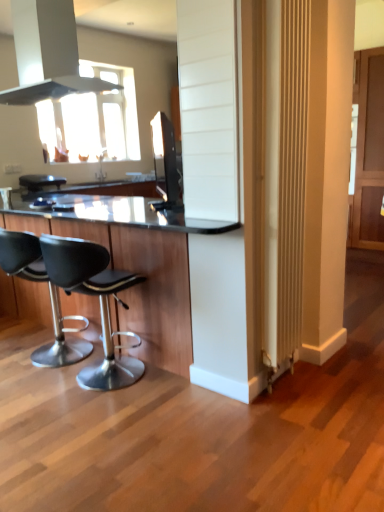
In order to face satin black tv at upper center, should I rotate leftwards or rightwards?

You should rotate left by 4.510 degrees.

Locate an element on the screen. The width and height of the screenshot is (384, 512). black matte exhaust hood at upper left is located at coordinates (47, 53).

This screenshot has height=512, width=384. What do you see at coordinates (40, 181) in the screenshot?
I see `black leather bar stool at center` at bounding box center [40, 181].

Locate an element on the screen. The width and height of the screenshot is (384, 512). black glass table at center is located at coordinates (133, 263).

The image size is (384, 512). I want to click on black leather stool at left, the second chair in the left-to-right sequence, so click(99, 300).

Locate an element on the screen. Image resolution: width=384 pixels, height=512 pixels. satin black tv at upper center is located at coordinates (165, 162).

Based on the photo, how different are the orientations of black leather stool at lower left, the 2th chair positioned from the right, and black leather bar stool at center in degrees?

They differ by 91.6 degrees in their facing directions.

Is black leather stool at lower left, the first chair positioned from the left, spatially inside black leather bar stool at center, or outside of it?

black leather stool at lower left, the first chair positioned from the left, is outside black leather bar stool at center.

From the image's perspective, is black leather stool at lower left, the first chair positioned from the left, beneath black leather bar stool at center?

Correct, black leather stool at lower left, the first chair positioned from the left, appears lower than black leather bar stool at center in the image.

Between point (55, 302) and point (40, 189), which one is positioned in front?

The point (55, 302) is more forward.

How distant is black leather bar stool at center from black matte exhaust hood at upper left?

A distance of 5.30 feet exists between black leather bar stool at center and black matte exhaust hood at upper left.

Would you say black leather bar stool at center is to the left or to the right of black matte exhaust hood at upper left in the picture?

Based on their positions, black leather bar stool at center is located to the left of black matte exhaust hood at upper left.

The image size is (384, 512). Identify the location of bar stool that appears behind the black matte exhaust hood at upper left. (40, 181).

Is black leather bar stool at center directly adjacent to black matte exhaust hood at upper left?

They are not placed beside each other.

Based on the photo, from a real-world perspective, between satin black tv at upper center and black matte exhaust hood at upper left, who is vertically higher?

black matte exhaust hood at upper left.

Considering the relative positions of satin black tv at upper center and black matte exhaust hood at upper left in the image provided, is satin black tv at upper center to the left or to the right of black matte exhaust hood at upper left?

Based on their positions, satin black tv at upper center is located to the right of black matte exhaust hood at upper left.

Is satin black tv at upper center smaller than black matte exhaust hood at upper left?

Correct, satin black tv at upper center occupies less space than black matte exhaust hood at upper left.

Can you confirm if satin black tv at upper center is taller than black matte exhaust hood at upper left?

Incorrect, the height of satin black tv at upper center is not larger of that of black matte exhaust hood at upper left.

Could you tell me if black leather bar stool at center is facing satin black tv at upper center?

Yes, black leather bar stool at center is turned towards satin black tv at upper center.

Where is `appliance to the right of black leather bar stool at center`? Image resolution: width=384 pixels, height=512 pixels. appliance to the right of black leather bar stool at center is located at coordinates (165, 162).

Who is taller, black leather bar stool at center or satin black tv at upper center?

satin black tv at upper center.

Is black leather bar stool at center facing away from black leather stool at lower left, the 2th chair positioned from the right?

No.

From the image's perspective, who appears lower, black leather bar stool at center or black leather stool at lower left, the first chair positioned from the left?

black leather stool at lower left, the first chair positioned from the left, appears lower in the image.

Is point (30, 187) closer or farther from the camera than point (42, 268)?

Clearly, point (30, 187) is more distant from the camera than point (42, 268).

Which of these two, black leather bar stool at center or black leather stool at lower left, the 2th chair positioned from the right, stands taller?

black leather stool at lower left, the 2th chair positioned from the right, is taller.

What's the angular difference between black matte exhaust hood at upper left and black leather bar stool at center's facing directions?

They differ by 92.6 degrees in their facing directions.

In terms of size, does black matte exhaust hood at upper left appear bigger or smaller than black leather bar stool at center?

Considering their sizes, black matte exhaust hood at upper left takes up more space than black leather bar stool at center.

Considering the sizes of objects black matte exhaust hood at upper left and black leather bar stool at center in the image provided, who is shorter, black matte exhaust hood at upper left or black leather bar stool at center?

Standing shorter between the two is black leather bar stool at center.

Does black glass table at center have a larger size compared to black matte exhaust hood at upper left?

Yes.

Find the location of a particular element. This screenshot has width=384, height=512. exhaust hood that is above the black glass table at center (from a real-world perspective) is located at coordinates (47, 53).

What's the angular difference between black glass table at center and black matte exhaust hood at upper left's facing directions?

The facing directions of black glass table at center and black matte exhaust hood at upper left are 0.311 degrees apart.

Between black glass table at center and black matte exhaust hood at upper left, which one is positioned behind?

black matte exhaust hood at upper left is behind.

You are a GUI agent. You are given a task and a screenshot of the screen. Output one action in this format:
    pyautogui.click(x=<x>, y=<y>)
    Task: Click on the chair that is the 1st one when counting rightward from the black leather bar stool at center
    The width and height of the screenshot is (384, 512).
    Given the screenshot: What is the action you would take?
    point(50,297)

Locate an element on the screen. The image size is (384, 512). exhaust hood lying in front of the black leather bar stool at center is located at coordinates (47, 53).

From the image, which object appears to be nearer to black leather bar stool at center, black glass table at center or black leather stool at lower left, the 2th chair positioned from the right?

Based on the image, black leather stool at lower left, the 2th chair positioned from the right, appears to be nearer to black leather bar stool at center.

Based on the photo, based on their spatial positions, is satin black tv at upper center or black glass table at center further from black matte exhaust hood at upper left?

satin black tv at upper center lies further to black matte exhaust hood at upper left than the other object.

From the picture: Considering their positions, is black glass table at center positioned closer to satin black tv at upper center than black leather stool at lower left, the 2th chair positioned from the right?

black leather stool at lower left, the 2th chair positioned from the right, is positioned closer to the anchor satin black tv at upper center.

Consider the image. Which object lies further to the anchor point black leather stool at left, positioned as the 1th chair in right-to-left order, satin black tv at upper center or black matte exhaust hood at upper left?

Based on the image, satin black tv at upper center appears to be further to black leather stool at left, positioned as the 1th chair in right-to-left order.

Estimate the real-world distances between objects in this image. Which object is closer to black leather stool at lower left, the first chair positioned from the left, black leather bar stool at center or satin black tv at upper center?

black leather bar stool at center.

Which object lies further to the anchor point satin black tv at upper center, black leather stool at lower left, the 2th chair positioned from the right, or black leather bar stool at center?

Among the two, black leather stool at lower left, the 2th chair positioned from the right, is located further to satin black tv at upper center.

Estimate the real-world distances between objects in this image. Which object is further from black glass table at center, black leather stool at lower left, the first chair positioned from the left, or black matte exhaust hood at upper left?

black matte exhaust hood at upper left lies further to black glass table at center than the other object.

In the scene shown: When comparing their distances from black glass table at center, does black matte exhaust hood at upper left or black leather stool at left, positioned as the 1th chair in right-to-left order, seem closer?

black leather stool at left, positioned as the 1th chair in right-to-left order, is closer to black glass table at center.

The width and height of the screenshot is (384, 512). I want to click on table that lies between satin black tv at upper center and black leather stool at lower left, the first chair positioned from the left, from top to bottom, so click(133, 263).

At what (x,y) coordinates should I click in order to perform the action: click on chair positioned between black leather stool at left, positioned as the 1th chair in right-to-left order, and black leather bar stool at center from near to far. Please return your answer as a coordinate pair (x, y). This screenshot has height=512, width=384. Looking at the image, I should click on (50, 297).

You are a GUI agent. You are given a task and a screenshot of the screen. Output one action in this format:
    pyautogui.click(x=<x>, y=<y>)
    Task: Click on the table between black matte exhaust hood at upper left and black leather stool at lower left, the first chair positioned from the left, in the vertical direction
    
    Given the screenshot: What is the action you would take?
    pyautogui.click(x=133, y=263)

The height and width of the screenshot is (512, 384). What are the coordinates of `exhaust hood between satin black tv at upper center and black leather bar stool at center in the front-back direction` in the screenshot? It's located at (47, 53).